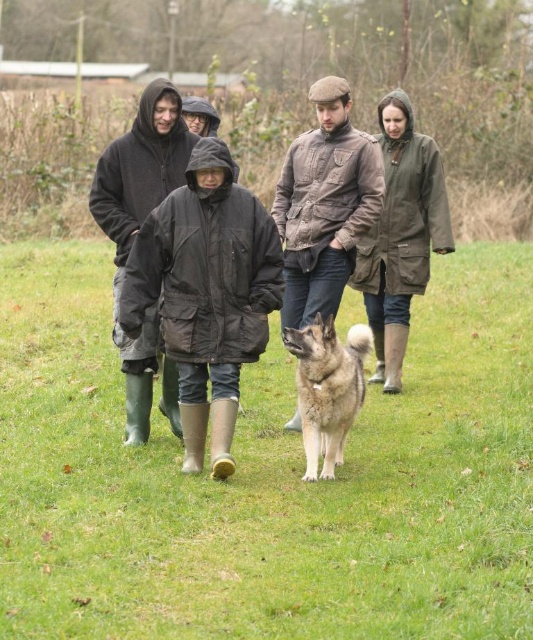
Who is lower down, brown textured jacket at center or brown fur dog at center?

brown fur dog at center is below.

Which of these two, brown textured jacket at center or brown fur dog at center, stands shorter?

brown fur dog at center is shorter.

What do you see at coordinates (325, 204) in the screenshot? The height and width of the screenshot is (640, 533). I see `brown textured jacket at center` at bounding box center [325, 204].

Identify the location of brown textured jacket at center. 325,204.

Is brown leather dog at center positioned before brown fur dog at center?

Yes.

Who is more distant from viewer, (366, 424) or (311, 413)?

The point (366, 424) is behind.

You are a GUI agent. You are given a task and a screenshot of the screen. Output one action in this format:
    pyautogui.click(x=<x>, y=<y>)
    Task: Click on the brown leather dog at center
    The width and height of the screenshot is (533, 640).
    Given the screenshot: What is the action you would take?
    pyautogui.click(x=268, y=477)

From the picture: Is black waterproof jacket at center closer to the viewer compared to olive-green waterproof coat at center?

Yes, black waterproof jacket at center is in front of olive-green waterproof coat at center.

Who is positioned more to the right, black waterproof jacket at center or olive-green waterproof coat at center?

olive-green waterproof coat at center

Which is in front, point (187, 451) or point (384, 321)?

Positioned in front is point (187, 451).

This screenshot has height=640, width=533. I want to click on black waterproof jacket at center, so click(x=206, y=292).